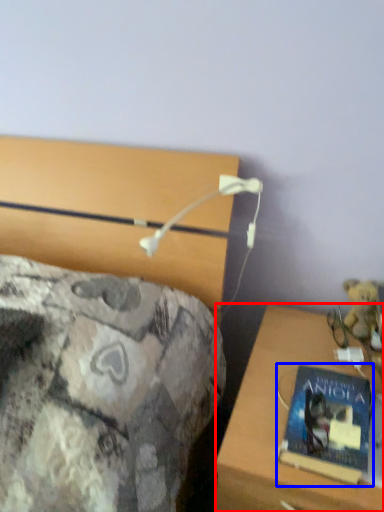
Question: Among these objects, which one is nearest to the camera, desk (highlighted by a red box) or book (highlighted by a blue box)?

Choices:
 (A) desk
 (B) book

Answer: (A)